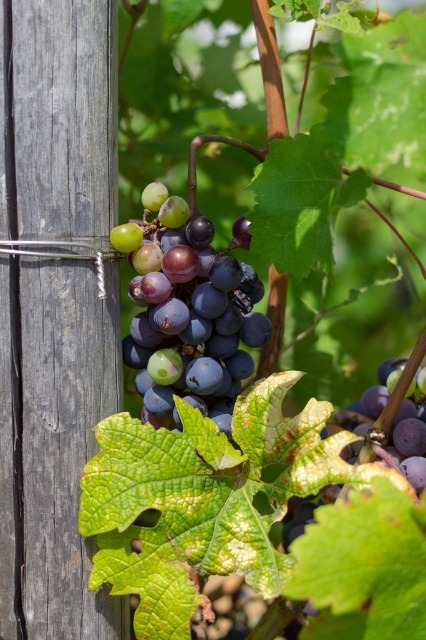
You are an inspector checking the grapes in the vineyard. You notice a point marked at coordinates (187, 310). What is located at that point?

The point at coordinates (187, 310) marks shiny purple grapes at center.

You are a fruit inspector holding a measuring tool that can only reach up to 1 meter. You need to check the ripeness of the shiny purple grapes at center. Can your tool reach them?

The shiny purple grapes at center are 1.02 meters away from the viewer, so the tool cannot reach them since it only extends up to 1 meter.